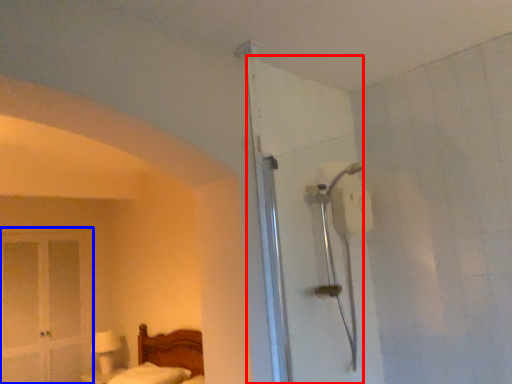
Question: Which of the following is the closest to the observer, door (highlighted by a red box) or screen door (highlighted by a blue box)?

Choices:
 (A) door
 (B) screen door

Answer: (A)